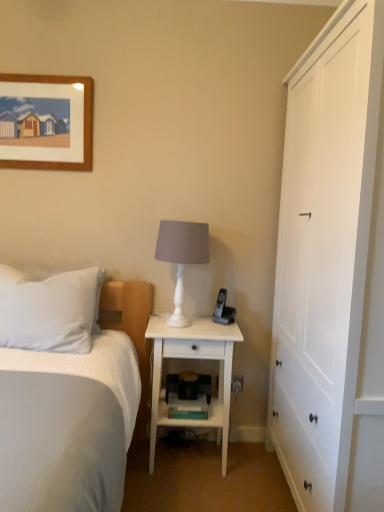
Question: Relative to black plastic phone at right, is white soft pillow at left in front or behind?

Choices:
 (A) behind
 (B) front

Answer: (B)

Question: Looking at the image, does white soft pillow at left seem bigger or smaller compared to black plastic phone at right?

Choices:
 (A) small
 (B) big

Answer: (B)

Question: Which is nearer to the white matte lamp at center?

Choices:
 (A) white textured bed at left
 (B) white wood cabinet at right
 (C) black plastic phone at right
 (D) white wood nightstand at center
 (E) white soft pillow at left

Answer: (D)

Question: Which of these objects is positioned closest to the white matte lamp at center?

Choices:
 (A) white soft pillow at left
 (B) white textured bed at left
 (C) white wood cabinet at right
 (D) white wood nightstand at center
 (E) black plastic phone at right

Answer: (D)